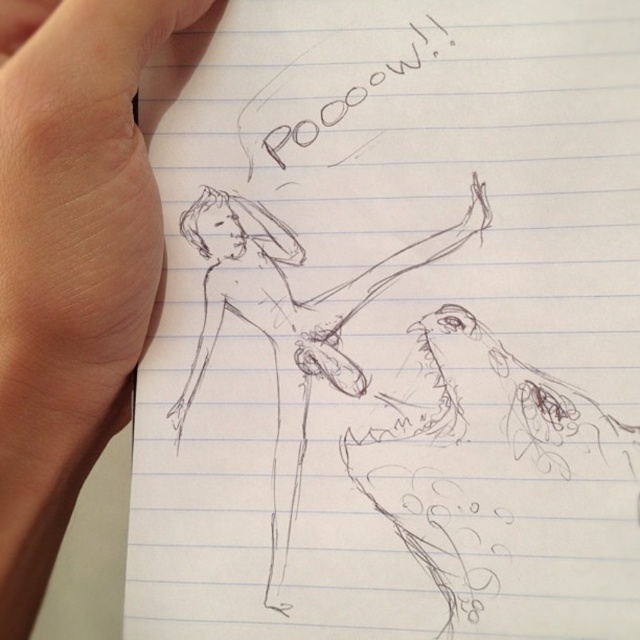
Can you confirm if black sketch figure at center is positioned to the right of skinny flesh at upper left?

Yes, black sketch figure at center is to the right of skinny flesh at upper left.

Which is in front, point (403, 460) or point (38, 68)?

Point (38, 68) is in front.

Is point (180, 436) farther from camera compared to point (13, 227)?

Yes, point (180, 436) is farther from viewer.

Identify the location of black sketch figure at center. (326, 396).